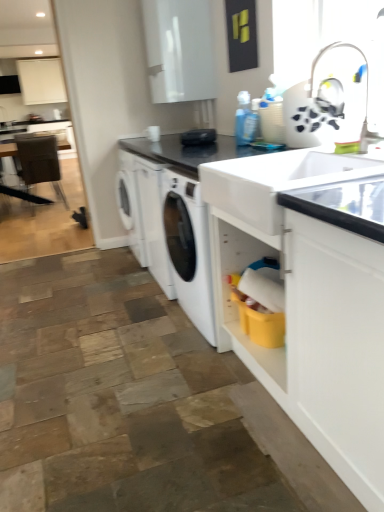
What do you see at coordinates (186, 151) in the screenshot? I see `black granite countertop at center, arranged as the first countertop when viewed from the top` at bounding box center [186, 151].

Locate an element on the screen. black granite countertop at center, arranged as the first countertop when viewed from the top is located at coordinates (186, 151).

What do you see at coordinates (277, 180) in the screenshot? Image resolution: width=384 pixels, height=512 pixels. I see `white glossy sink at center` at bounding box center [277, 180].

Find the location of a particular element. Image resolution: width=384 pixels, height=512 pixels. black matte sink at lower right, the first countertop from the bottom is located at coordinates pos(307,298).

The image size is (384, 512). In order to click on the 1st cabinetry behind when counting from the black granite countertop at center, acting as the second countertop starting from the bottom in this screenshot , I will do `click(179, 50)`.

Is black granite countertop at center, acting as the second countertop starting from the bottom, positioned in front of white glossy cabinet at upper center, the second cabinetry when ordered from left to right?

Yes, it is.

Considering the sizes of objects black granite countertop at center, acting as the second countertop starting from the bottom, and white glossy cabinet at upper center, which appears as the 2th cabinetry when viewed from the top, in the image provided, who is shorter, black granite countertop at center, acting as the second countertop starting from the bottom, or white glossy cabinet at upper center, which appears as the 2th cabinetry when viewed from the top,?

black granite countertop at center, acting as the second countertop starting from the bottom, is shorter.

Is white glossy sink at center shorter than black granite countertop at center, acting as the second countertop starting from the bottom?

No.

Is white glossy sink at center facing away from black granite countertop at center, acting as the second countertop starting from the bottom?

No, white glossy sink at center is not facing the opposite direction of black granite countertop at center, acting as the second countertop starting from the bottom.

What's the angular difference between white glossy sink at center and black granite countertop at center, acting as the second countertop starting from the bottom,'s facing directions?

The angular difference between white glossy sink at center and black granite countertop at center, acting as the second countertop starting from the bottom, is 1.16 degrees.

Measure the distance from white glossy sink at center to black granite countertop at center, acting as the second countertop starting from the bottom.

white glossy sink at center and black granite countertop at center, acting as the second countertop starting from the bottom, are 21.32 inches apart from each other.

Between black matte sink at lower right, the 2th countertop from the top, and white plastic faucet at upper right, which one has smaller size?

With smaller size is white plastic faucet at upper right.

Considering the positions of point (294, 410) and point (324, 47), is point (294, 410) closer or farther from the camera than point (324, 47)?

Point (294, 410) is positioned closer to the camera compared to point (324, 47).

Could you tell me if black matte sink at lower right, the 2th countertop from the top, is facing white plastic faucet at upper right?

No.

Does black granite countertop at center, arranged as the first countertop when viewed from the top, come behind white plastic faucet at upper right?

Yes, the depth of black granite countertop at center, arranged as the first countertop when viewed from the top, is greater than that of white plastic faucet at upper right.

Is black granite countertop at center, acting as the second countertop starting from the bottom, not near white plastic faucet at upper right?

black granite countertop at center, acting as the second countertop starting from the bottom, is actually quite close to white plastic faucet at upper right.

From the image's perspective, does black granite countertop at center, arranged as the first countertop when viewed from the top, appear higher than white plastic faucet at upper right?

Yes, from the image's perspective, black granite countertop at center, arranged as the first countertop when viewed from the top, is above white plastic faucet at upper right.

Considering the positions of points (153, 159) and (324, 55), is point (153, 159) closer to camera compared to point (324, 55)?

No.

Is point (292, 150) behind point (210, 34)?

No, (292, 150) is closer to viewer.

From a real-world perspective, starting from the white glossy sink at center, which cabinetry is the 1st one vertically above it? Please provide its 2D coordinates.

[(179, 50)]

Can you confirm if white glossy sink at center is positioned to the left of white glossy cabinet at upper center, which ranks as the 1th cabinetry in right-to-left order?

No, white glossy sink at center is not to the left of white glossy cabinet at upper center, which ranks as the 1th cabinetry in right-to-left order.

Could you measure the distance between white glossy sink at center and black matte sink at lower right, the 2th countertop from the top?

They are 17.16 centimeters apart.

Does white glossy sink at center lie in front of black matte sink at lower right, the 2th countertop from the top?

No.

Is white glossy sink at center oriented away from black matte sink at lower right, the 2th countertop from the top?

That's right, white glossy sink at center is facing away from black matte sink at lower right, the 2th countertop from the top.

From the image's perspective, is white glossy sink at center located above black matte sink at lower right, the first countertop from the bottom?

Yes, from the image's perspective, white glossy sink at center is above black matte sink at lower right, the first countertop from the bottom.

Which object is further away from the camera taking this photo, black matte toaster at center or white glossy cabinet at upper center, arranged as the first cabinetry when ordered from the bottom?

white glossy cabinet at upper center, arranged as the first cabinetry when ordered from the bottom, is further from the camera.

In the scene shown: In the image, is black matte toaster at center on the left side or the right side of white glossy cabinet at upper center, the 1th cabinetry positioned from the front?

From the image, it's evident that black matte toaster at center is to the right of white glossy cabinet at upper center, the 1th cabinetry positioned from the front.

From a real-world perspective, which object stands above the other?

white glossy cabinet at upper center, arranged as the first cabinetry when ordered from the bottom, from a real-world perspective.

The height and width of the screenshot is (512, 384). Identify the location of cabinetry that is the 1st one when counting upward from the black granite countertop at center, arranged as the first countertop when viewed from the top (from the image's perspective). (179, 50).

The height and width of the screenshot is (512, 384). In order to click on sink on the right of black granite countertop at center, acting as the second countertop starting from the bottom in this screenshot , I will do `click(277, 180)`.

Considering their positions, is brown leather chair at left positioned further to black matte sink at lower right, the first countertop from the bottom, than white plastic faucet at upper right?

Based on the image, brown leather chair at left appears to be further to black matte sink at lower right, the first countertop from the bottom.

Estimate the real-world distances between objects in this image. Which object is further from brown leather chair at left, white plastic faucet at upper right or white glossy cabinet at upper center, the second cabinetry when ordered from left to right?

white plastic faucet at upper right is further to brown leather chair at left.

From the picture: When comparing their distances from black matte toaster at center, does brown leather chair at left or white matte cabinet at upper left, the 2th cabinetry in the front-to-back sequence, seem closer?

The object closer to black matte toaster at center is brown leather chair at left.

When comparing their distances from brown leather chair at left, does black matte sink at lower right, the 2th countertop from the top, or white glossy cabinet at upper center, which appears as the 2th cabinetry when viewed from the top, seem further?

black matte sink at lower right, the 2th countertop from the top, lies further to brown leather chair at left than the other object.

Looking at the image, which one is located further to black granite countertop at center, acting as the second countertop starting from the bottom, brown leather chair at left or black matte sink at lower right, the first countertop from the bottom?

The object further to black granite countertop at center, acting as the second countertop starting from the bottom, is brown leather chair at left.

Considering their positions, is black matte sink at lower right, the first countertop from the bottom, positioned closer to white glossy sink at center than white matte cabinet at upper left, arranged as the 1th cabinetry when viewed from the back?

black matte sink at lower right, the first countertop from the bottom, lies closer to white glossy sink at center than the other object.

Looking at the image, which one is located further to white plastic faucet at upper right, white glossy cabinet at upper center, marked as the 2th cabinetry in a back-to-front arrangement, or black matte sink at lower right, the first countertop from the bottom?

Based on the image, white glossy cabinet at upper center, marked as the 2th cabinetry in a back-to-front arrangement, appears to be further to white plastic faucet at upper right.

Which object lies further to the anchor point white matte cabinet at upper left, the 2th cabinetry in the front-to-back sequence, black matte toaster at center or white glossy cabinet at upper center, the 1th cabinetry positioned from the front?

black matte toaster at center is positioned further to the anchor white matte cabinet at upper left, the 2th cabinetry in the front-to-back sequence.

What are the coordinates of `faucet between black matte sink at lower right, the first countertop from the bottom, and black granite countertop at center, arranged as the first countertop when viewed from the top, from front to back` in the screenshot? It's located at (342, 91).

At what (x,y) coordinates should I click in order to perform the action: click on chair between black matte sink at lower right, the 2th countertop from the top, and white matte cabinet at upper left, placed as the first cabinetry when sorted from left to right, along the z-axis. Please return your answer as a coordinate pair (x, y). The image size is (384, 512). Looking at the image, I should click on (39, 161).

Find the location of a particular element. This screenshot has width=384, height=512. cabinetry positioned between black matte toaster at center and brown leather chair at left from near to far is located at coordinates (179, 50).

Locate an element on the screen. The image size is (384, 512). countertop between black matte sink at lower right, the first countertop from the bottom, and black matte toaster at center from front to back is located at coordinates (186, 151).